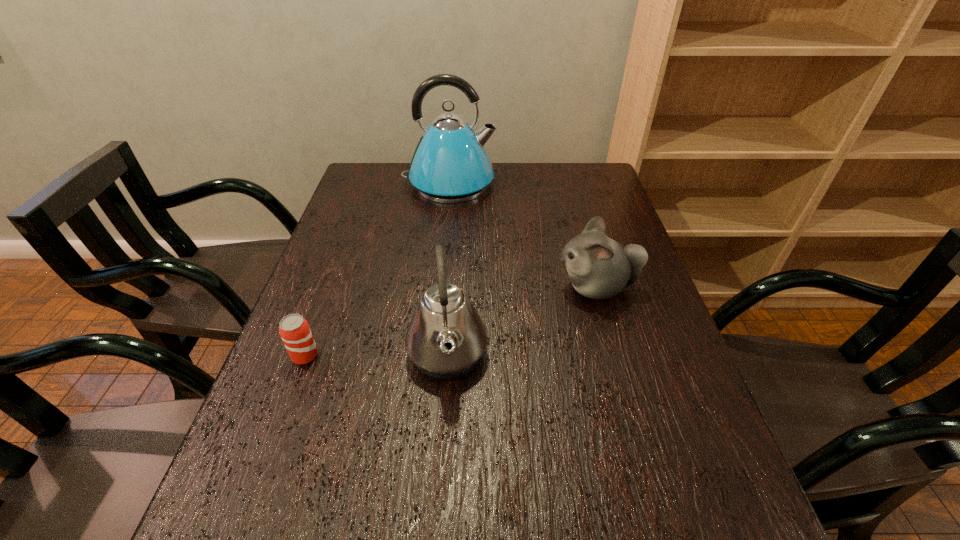
Where is `vacant space located on the face of the hamster`? This screenshot has height=540, width=960. vacant space located on the face of the hamster is located at coordinates (438, 287).

The width and height of the screenshot is (960, 540). I want to click on free spot located on the face of the hamster, so click(397, 287).

I want to click on vacant region located on the face of the hamster, so click(491, 287).

You are a GUI agent. You are given a task and a screenshot of the screen. Output one action in this format:
    pyautogui.click(x=<x>, y=<y>)
    Task: Click on the free location located 0.180m on the right of the beer can
    
    Given the screenshot: What is the action you would take?
    pyautogui.click(x=403, y=356)

Where is `object located at the far edge`? This screenshot has height=540, width=960. object located at the far edge is located at coordinates (450, 164).

Locate an element on the screen. The width and height of the screenshot is (960, 540). object that is at the left edge is located at coordinates (294, 330).

Locate an element on the screen. The height and width of the screenshot is (540, 960). object that is at the right edge is located at coordinates (598, 267).

Where is `vacant space at the far edge`? The height and width of the screenshot is (540, 960). vacant space at the far edge is located at coordinates (552, 174).

Where is `free space at the left edge of the desktop`? Image resolution: width=960 pixels, height=540 pixels. free space at the left edge of the desktop is located at coordinates (320, 439).

You are a GUI agent. You are given a task and a screenshot of the screen. Output one action in this format:
    pyautogui.click(x=<x>, y=<y>)
    Task: Click on the blank area at the right edge
    The width and height of the screenshot is (960, 540).
    Given the screenshot: What is the action you would take?
    pyautogui.click(x=655, y=353)